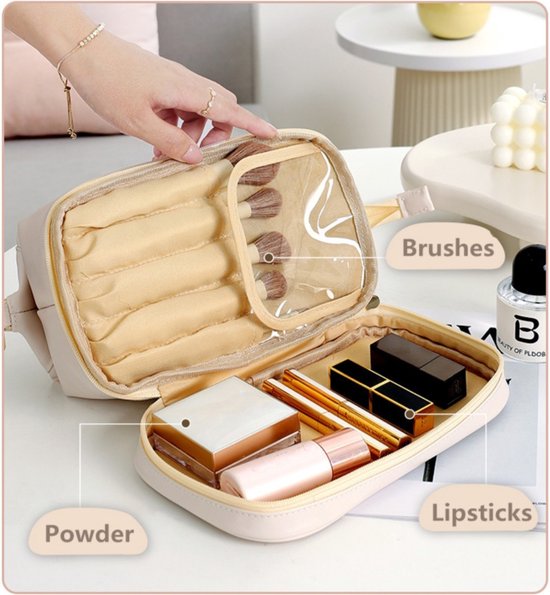
Identify the location of tables. (436, 50), (439, 155), (46, 482), (445, 292), (410, 36), (447, 12), (251, 572).